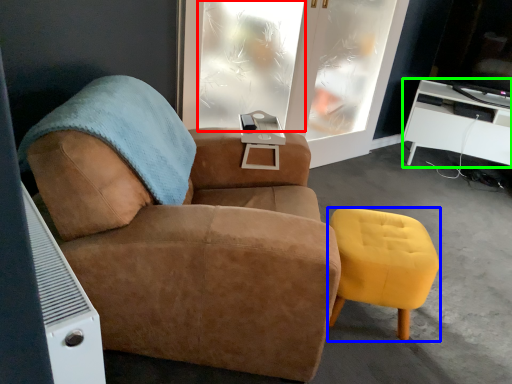
Question: Estimate the real-world distances between objects in this image. Which object is closer to window (highlighted by a red box), stool (highlighted by a blue box) or desk (highlighted by a green box)?

Choices:
 (A) stool
 (B) desk

Answer: (A)